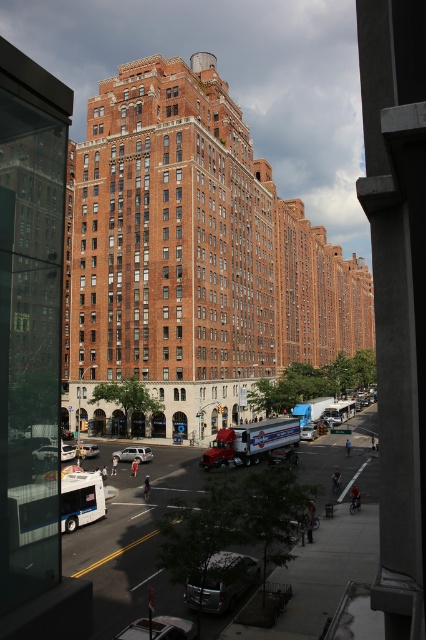
Can you confirm if metallic silver car at lower left is thinner than metallic silver van at center?

Indeed, metallic silver car at lower left has a lesser width compared to metallic silver van at center.

Between metallic silver car at lower left and metallic silver van at center, which one has less height?

metallic silver car at lower left is shorter.

Image resolution: width=426 pixels, height=640 pixels. I want to click on metallic silver car at lower left, so click(x=158, y=628).

Locate an element on the screen. Image resolution: width=426 pixels, height=640 pixels. metallic silver car at lower left is located at coordinates (158, 628).

Is brick building at center thinner than silver metallic car at center?

Incorrect, brick building at center's width is not less than silver metallic car at center's.

Between brick building at center and silver metallic car at center, which one is positioned lower?

silver metallic car at center is below.

Does point (86, 177) come behind point (94, 456)?

That is True.

You are a GUI agent. You are given a task and a screenshot of the screen. Output one action in this format:
    pyautogui.click(x=<x>, y=<y>)
    Task: Click on the brick building at center
    
    Given the screenshot: What is the action you would take?
    pyautogui.click(x=195, y=243)

Which is behind, point (32, 451) or point (95, 456)?

Point (95, 456)

Between shiny silver car at lower left and silver metallic car at center, which one appears on the left side from the viewer's perspective?

Positioned to the left is silver metallic car at center.

Is point (46, 454) behind point (85, 445)?

No, it is not.

Locate an element on the screen. The width and height of the screenshot is (426, 640). shiny silver car at lower left is located at coordinates (46, 452).